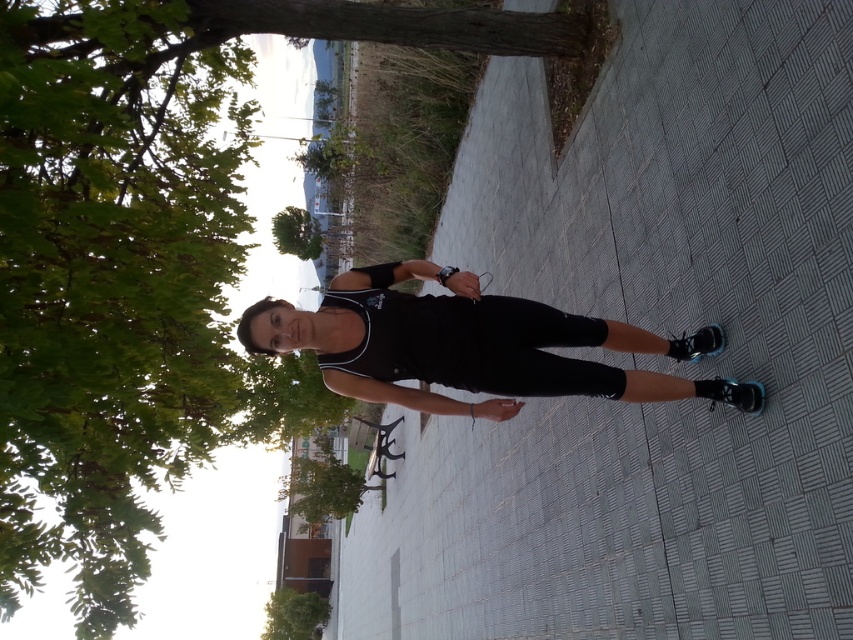
You are a photographer trying to capture a portrait of the person wearing the black matte tank top at center. If your camera has a minimum focusing distance of 2 meters, will you be able to take a clear photo without moving closer?

The black matte tank top at center is 2.28 meters from the camera. Since the minimum focusing distance is 2 meters, the photographer can take a clear photo without moving closer because the subject is within the camera range.

You are a hiker trying to navigate through the park. You see the green leafy tree at upper left and the green leafy tree at lower left. Which tree would you choose to use as a landmark for your map if you want to indicate a taller landmark?

The green leafy tree at upper left is much taller than the green leafy tree at lower left, so you should choose the green leafy tree at upper left as the landmark.

You are a photographer trying to capture a photo of the black matte tank top at center without including the green leafy tree at upper left in the frame. Is this possible based on their positions?

The green leafy tree at upper left is positioned over the black matte tank top at center, so it would be difficult to capture the black matte tank top at center without including the tree in the frame unless moving the camera angle or repositioning the subject.